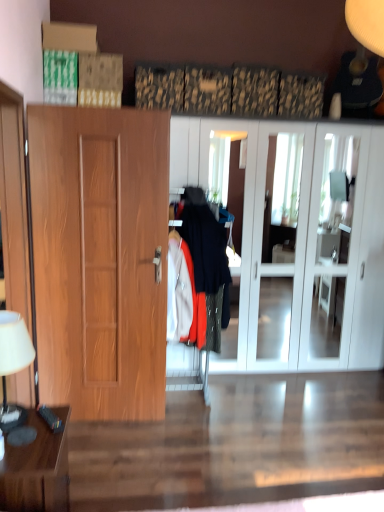
Question: Is white glossy cabinet at center far away from white fabric lampshade at left?

Choices:
 (A) no
 (B) yes

Answer: (B)

Question: From a real-world perspective, is white glossy cabinet at center physically above white fabric lampshade at left?

Choices:
 (A) no
 (B) yes

Answer: (B)

Question: Would you say white fabric lampshade at left is part of white glossy cabinet at center's contents?

Choices:
 (A) yes
 (B) no

Answer: (B)

Question: Is white glossy cabinet at center placed right next to white fabric lampshade at left?

Choices:
 (A) yes
 (B) no

Answer: (B)

Question: Considering the relative sizes of white glossy cabinet at center and white fabric lampshade at left in the image provided, is white glossy cabinet at center bigger than white fabric lampshade at left?

Choices:
 (A) no
 (B) yes

Answer: (B)

Question: Is white glossy cabinet at center positioned beyond the bounds of white fabric lampshade at left?

Choices:
 (A) no
 (B) yes

Answer: (B)

Question: From a real-world perspective, is wooden door at left under black plastic remote control at lower left?

Choices:
 (A) no
 (B) yes

Answer: (A)

Question: From the image's perspective, is wooden door at left over black plastic remote control at lower left?

Choices:
 (A) no
 (B) yes

Answer: (B)

Question: Can you confirm if wooden door at left is wider than black plastic remote control at lower left?

Choices:
 (A) no
 (B) yes

Answer: (B)

Question: Is wooden door at left positioned with its back to black plastic remote control at lower left?

Choices:
 (A) no
 (B) yes

Answer: (B)

Question: Is wooden door at left outside of black plastic remote control at lower left?

Choices:
 (A) no
 (B) yes

Answer: (B)

Question: From a real-world perspective, does wooden door at left stand above black plastic remote control at lower left?

Choices:
 (A) no
 (B) yes

Answer: (B)

Question: From a real-world perspective, is brown wooden table at lower left physically below black plastic remote control at lower left?

Choices:
 (A) yes
 (B) no

Answer: (A)